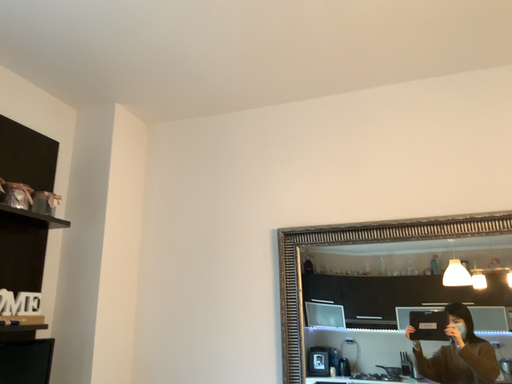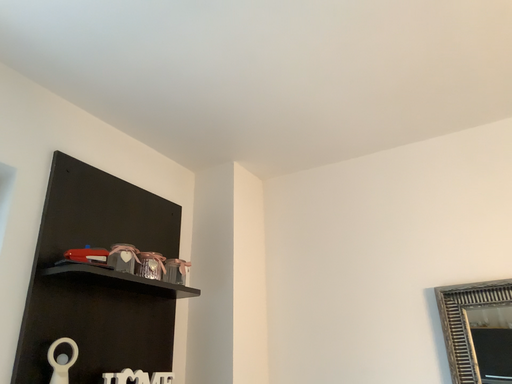
Question: How did the camera likely rotate when shooting the video?

Choices:
 (A) rotated right
 (B) rotated left

Answer: (B)